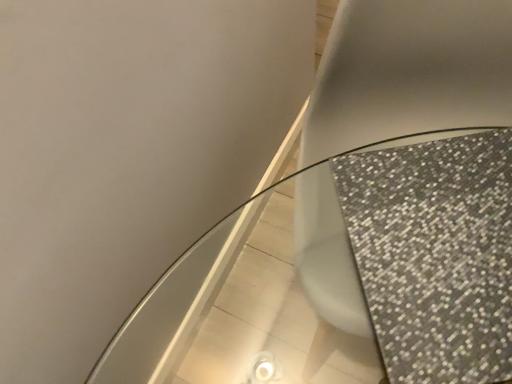
Question: Is sparkly glass table at center wider or thinner than matte gray toilet at center?

Choices:
 (A) thin
 (B) wide

Answer: (A)

Question: In terms of size, does sparkly glass table at center appear bigger or smaller than matte gray toilet at center?

Choices:
 (A) small
 (B) big

Answer: (A)

Question: Choose the correct answer: Is sparkly glass table at center inside matte gray toilet at center or outside it?

Choices:
 (A) outside
 (B) inside

Answer: (B)

Question: Would you say matte gray toilet at center is to the left or to the right of sparkly glass table at center in the picture?

Choices:
 (A) right
 (B) left

Answer: (A)

Question: From a real-world perspective, is matte gray toilet at center positioned above or below sparkly glass table at center?

Choices:
 (A) below
 (B) above

Answer: (B)

Question: Is matte gray toilet at center in front of or behind sparkly glass table at center in the image?

Choices:
 (A) front
 (B) behind

Answer: (B)

Question: Is point (343, 221) closer or farther from the camera than point (303, 259)?

Choices:
 (A) closer
 (B) farther

Answer: (B)